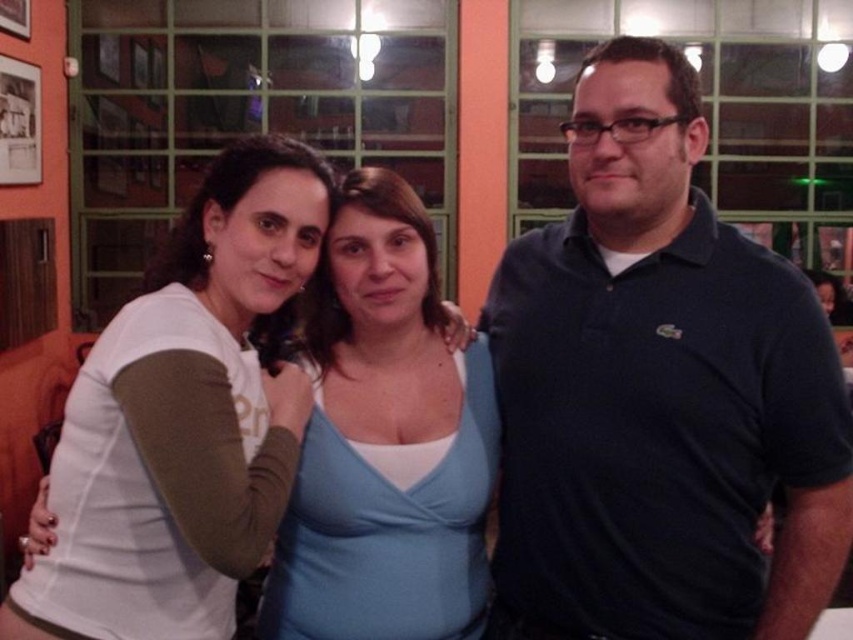
Question: Can you confirm if dark blue polo shirt at center is positioned above light blue fabric top at center?

Choices:
 (A) no
 (B) yes

Answer: (B)

Question: Among these objects, which one is farthest from the camera?

Choices:
 (A) light blue fabric top at center
 (B) white matte shirt at upper left

Answer: (A)

Question: Estimate the real-world distances between objects in this image. Which object is closer to the white matte shirt at upper left?

Choices:
 (A) dark blue polo shirt at center
 (B) light blue fabric top at center

Answer: (B)

Question: Does dark blue polo shirt at center have a greater width compared to white matte shirt at upper left?

Choices:
 (A) no
 (B) yes

Answer: (B)

Question: Considering the relative positions of dark blue polo shirt at center and light blue fabric top at center in the image provided, where is dark blue polo shirt at center located with respect to light blue fabric top at center?

Choices:
 (A) left
 (B) right

Answer: (B)

Question: Which object is positioned farthest from the light blue fabric top at center?

Choices:
 (A) dark blue polo shirt at center
 (B) white matte shirt at upper left

Answer: (A)